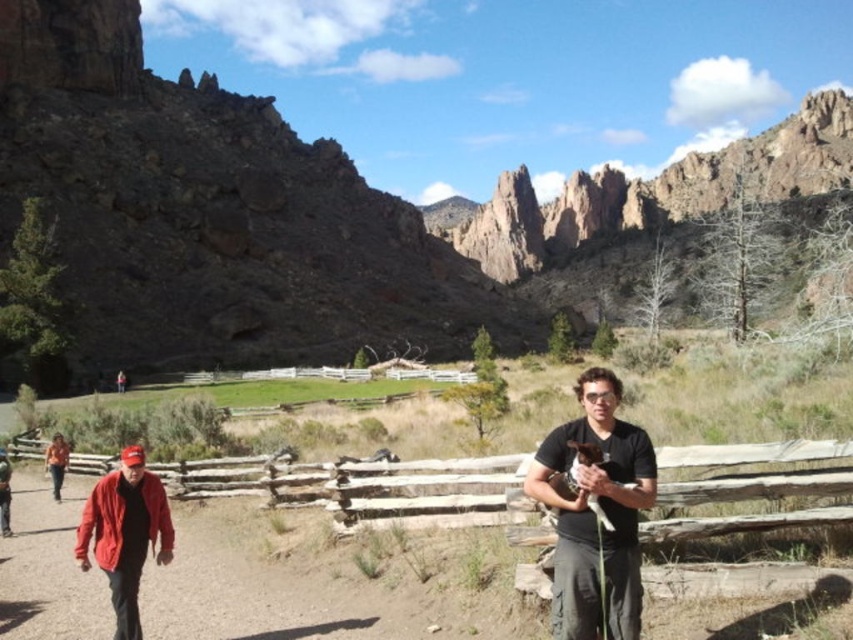
Is point (183, 480) more distant than point (51, 468)?

No, (183, 480) is in front of (51, 468).

Is wooden at center bigger than orange shirt at lower left?

Yes, wooden at center is bigger than orange shirt at lower left.

The width and height of the screenshot is (853, 640). What do you see at coordinates (366, 484) in the screenshot?
I see `wooden at center` at bounding box center [366, 484].

Where is `wooden at center`? wooden at center is located at coordinates (366, 484).

Is wooden at center thinner than black matte shirt at center?

No, wooden at center is not thinner than black matte shirt at center.

Is wooden at center below black matte shirt at center?

Indeed, wooden at center is positioned under black matte shirt at center.

Measure the distance between point (x=282, y=483) and camera.

Point (x=282, y=483) and camera are 42.87 meters apart.

At what (x,y) coordinates should I click in order to perform the action: click on wooden at center. Please return your answer as a coordinate pair (x, y). Image resolution: width=853 pixels, height=640 pixels. Looking at the image, I should click on (366, 484).

Which is in front, point (334, 508) or point (293, 376)?

Point (334, 508) is in front.

What do you see at coordinates (366, 484) in the screenshot? Image resolution: width=853 pixels, height=640 pixels. I see `wooden at center` at bounding box center [366, 484].

Who is more forward, (15,458) or (274,374)?

Positioned in front is point (15,458).

The image size is (853, 640). In order to click on wooden at center in this screenshot , I will do `click(366, 484)`.